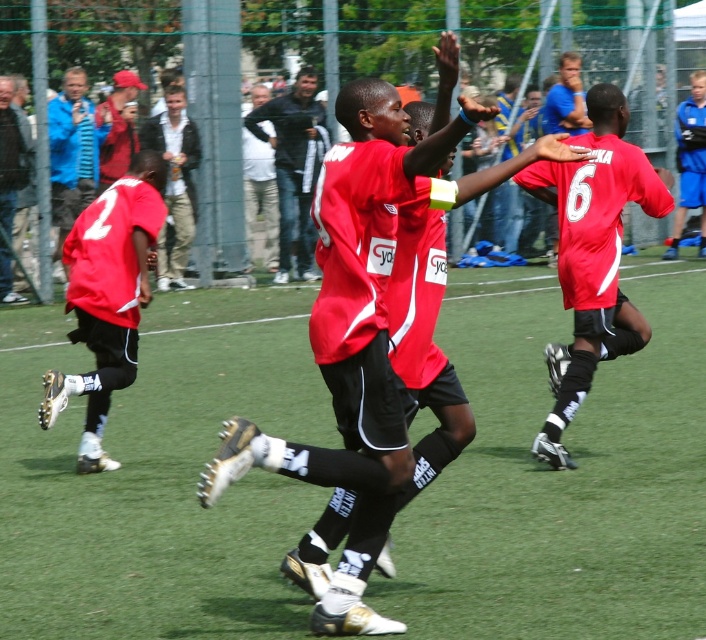
Question: Considering the relative positions of matte red jersey at center and matte red jersey at left in the image provided, where is matte red jersey at center located with respect to matte red jersey at left?

Choices:
 (A) above
 (B) below

Answer: (A)

Question: In this image, where is matte red jersey at center located relative to matte red jersey at left?

Choices:
 (A) right
 (B) left

Answer: (A)

Question: Which point is farther to the camera?

Choices:
 (A) matte red jersey at center
 (B) matte red jersey at left

Answer: (B)

Question: Is the position of matte red jersey at center more distant than that of matte red jersey at left?

Choices:
 (A) no
 (B) yes

Answer: (A)